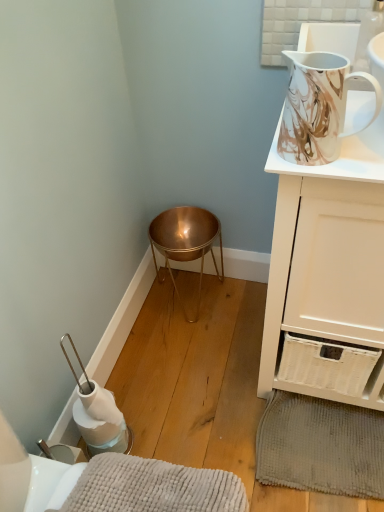
Question: Relative to gray textured bath mat at lower right, the 2th bath mat in the front-to-back sequence, is white glossy cabinet at upper right in front or behind?

Choices:
 (A) front
 (B) behind

Answer: (A)

Question: From a real-world perspective, relative to gray textured bath mat at lower right, which appears as the 1th bath mat when viewed from the back, is white glossy cabinet at upper right vertically above or below?

Choices:
 (A) below
 (B) above

Answer: (B)

Question: Which of these objects is positioned closest to the white glossy cabinet at upper right?

Choices:
 (A) gray textured bath mat at lower right, arranged as the 2th bath mat when viewed from the left
 (B) marble-patterned ceramic jug at upper right
 (C) copper metallic bowl at lower center
 (D) soft gray plush bath mat at lower left, arranged as the second bath mat when viewed from the right

Answer: (B)

Question: Estimate the real-world distances between objects in this image. Which object is closer to the marble-patterned ceramic jug at upper right?

Choices:
 (A) white glossy cabinet at upper right
 (B) soft gray plush bath mat at lower left, the second bath mat positioned from the back
 (C) gray textured bath mat at lower right, the 2th bath mat in the front-to-back sequence
 (D) copper metallic bowl at lower center

Answer: (A)